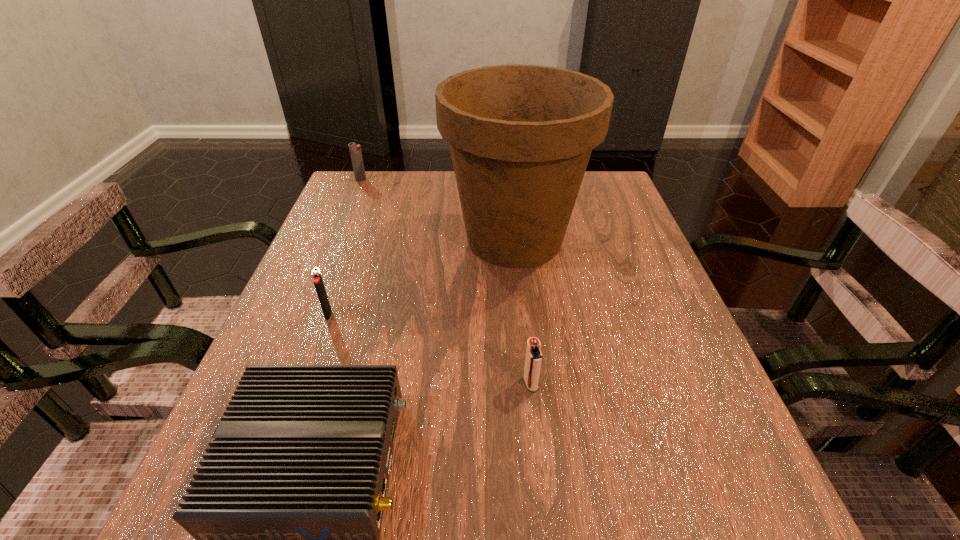
Locate an element on the screen. Image resolution: width=960 pixels, height=540 pixels. flowerpot is located at coordinates (520, 136).

Locate an element on the screen. the tallest object is located at coordinates 520,136.

At what (x,y) coordinates should I click in order to perform the action: click on the leftmost igniter. Please return your answer as a coordinate pair (x, y). The width and height of the screenshot is (960, 540). Looking at the image, I should click on (355, 151).

You are a GUI agent. You are given a task and a screenshot of the screen. Output one action in this format:
    pyautogui.click(x=<x>, y=<y>)
    Task: Click on the farthest object
    The height and width of the screenshot is (540, 960).
    Given the screenshot: What is the action you would take?
    pyautogui.click(x=355, y=151)

The width and height of the screenshot is (960, 540). Identify the location of the second farthest igniter. click(x=317, y=278).

I want to click on the third nearest object, so click(x=317, y=278).

This screenshot has height=540, width=960. In order to click on the nearest igniter in this screenshot , I will do `click(533, 361)`.

What are the coordinates of `the rightmost igniter` in the screenshot? It's located at (533, 361).

Where is `free location located on the front of the flowerpot`? free location located on the front of the flowerpot is located at coordinates (523, 324).

Identify the location of vacant space located 0.320m on the front of the farthest igniter. The width and height of the screenshot is (960, 540). (332, 249).